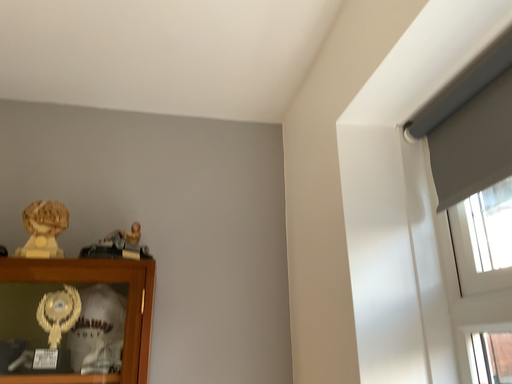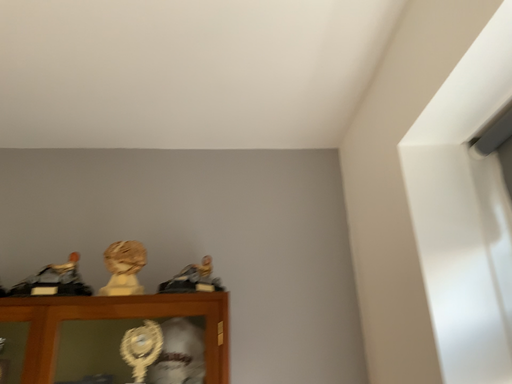
Question: Which way did the camera rotate in the video?

Choices:
 (A) rotated left
 (B) rotated right

Answer: (A)